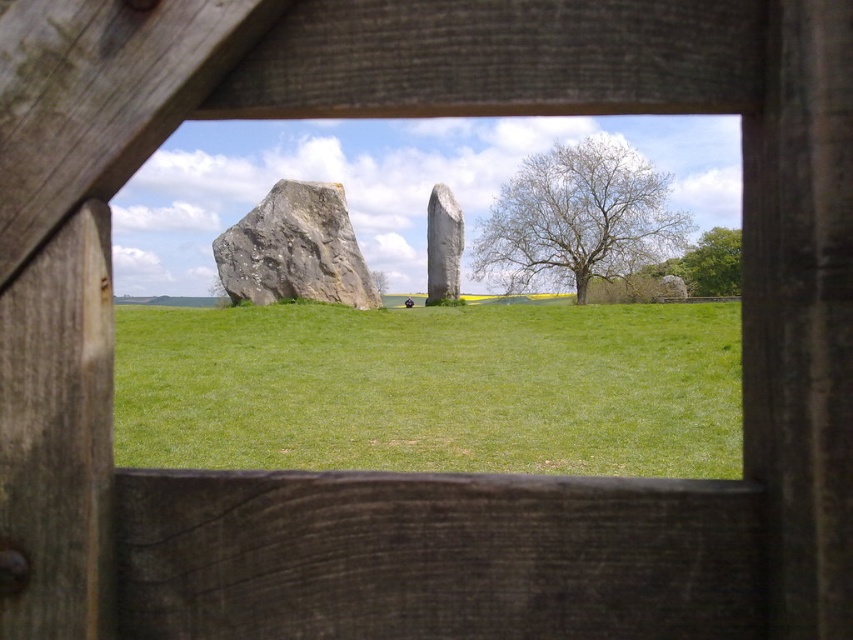
Does transparent glass window at center have a greater height compared to bare wood tree at right?

Yes, transparent glass window at center is taller than bare wood tree at right.

Can you confirm if transparent glass window at center is smaller than bare wood tree at right?

Actually, transparent glass window at center might be larger than bare wood tree at right.

Does point (463, 432) come in front of point (682, 218)?

Yes, it is.

I want to click on transparent glass window at center, so click(x=426, y=328).

Between point (572, 221) and point (256, 285), which one is positioned behind?

Positioned behind is point (572, 221).

Between bare wood tree at right and gray rough stone at left, which one is positioned lower?

gray rough stone at left

Does point (608, 177) lie in front of point (289, 192)?

No, (608, 177) is further to viewer.

This screenshot has width=853, height=640. Identify the location of bare wood tree at right. (578, 218).

Is the position of green grass at center more distant than that of green leafy tree at upper right?

No, green grass at center is in front of green leafy tree at upper right.

Who is more distant from viewer, (389, 396) or (703, 291)?

Point (703, 291)

Identify the location of green grass at center. (432, 388).

Where is `green grass at center`? The width and height of the screenshot is (853, 640). green grass at center is located at coordinates (432, 388).